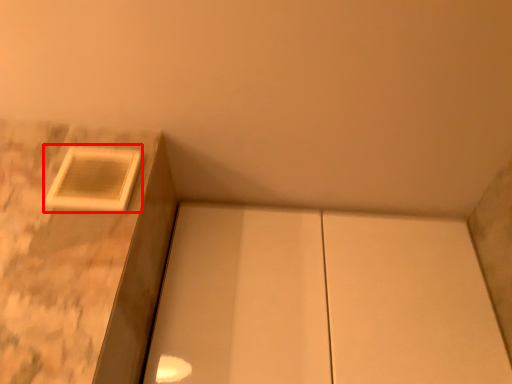
Question: Observing the image, what is the correct spatial positioning of window (annotated by the red box) in reference to cabinetry?

Choices:
 (A) right
 (B) left

Answer: (B)